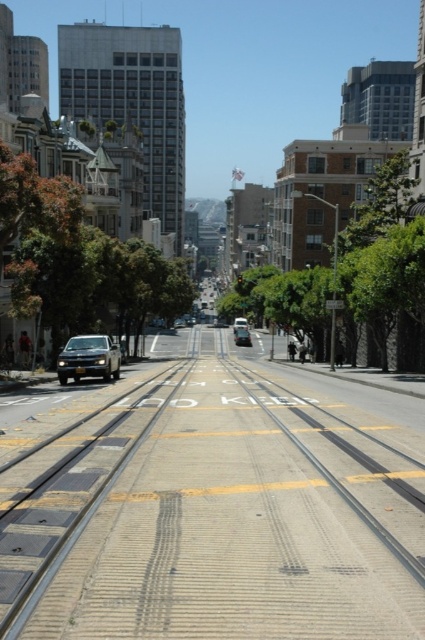
Question: Among these points, which one is farthest from the camera?

Choices:
 (A) (235, 340)
 (B) (85, 376)
 (C) (240, 326)
 (D) (180, 374)

Answer: (C)

Question: Can you confirm if shiny silver sedan at center is positioned below metallic silver car at center?

Choices:
 (A) no
 (B) yes

Answer: (B)

Question: Which of the following is the closest to the observer?

Choices:
 (A) (237, 340)
 (B) (376, 611)
 (C) (246, 321)

Answer: (B)

Question: Is shiny silver suv at center below shiny silver sedan at center?

Choices:
 (A) no
 (B) yes

Answer: (A)

Question: Which point is closer to the camera?

Choices:
 (A) shiny silver suv at center
 (B) yellow asphalt track at center

Answer: (B)

Question: Does yellow asphalt track at center appear on the left side of metallic silver car at center?

Choices:
 (A) no
 (B) yes

Answer: (B)